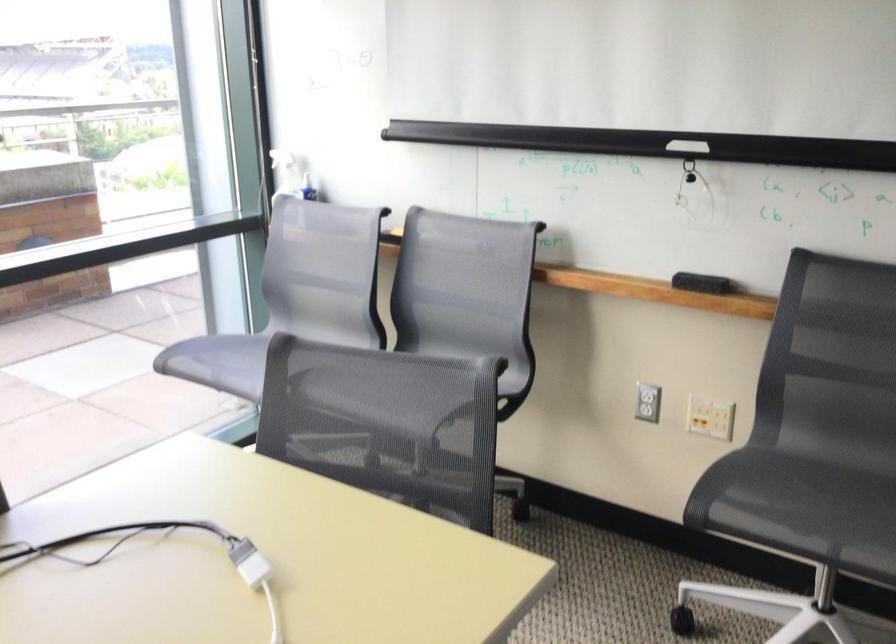
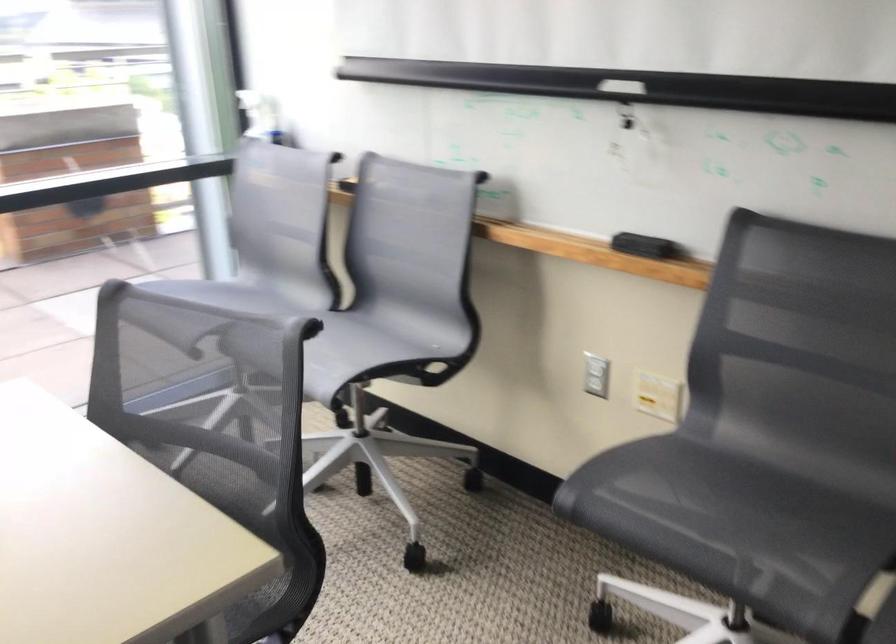
In the second image, find the point that corresponds to point (648, 401) in the first image.

(596, 375)